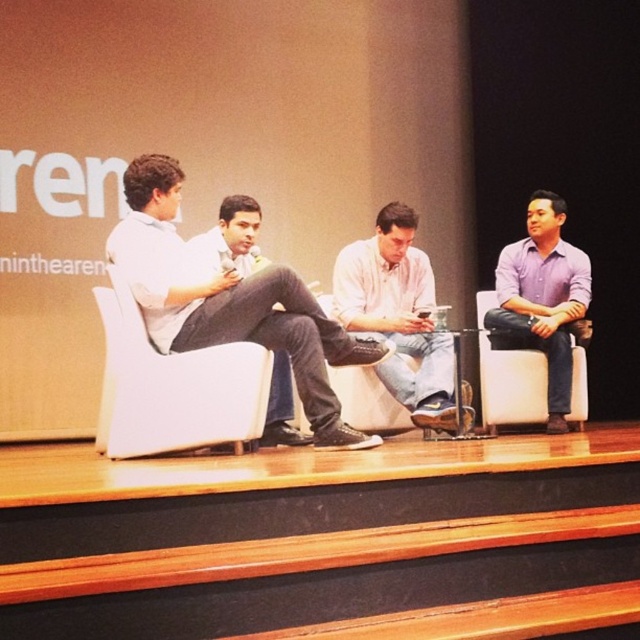
Question: Which of the following is the farthest from the observer?

Choices:
 (A) (352, 284)
 (B) (225, 372)
 (C) (230, 310)
 (D) (208, 234)

Answer: (A)

Question: Which of the following is the closest to the observer?

Choices:
 (A) white fabric armchair at center
 (B) dark gray jeans at center

Answer: (A)

Question: Which of the following is the farthest from the observer?

Choices:
 (A) (364, 280)
 (B) (125, 412)
 (C) (180, 284)

Answer: (A)

Question: Does white cotton shirt at center appear on the right side of dark gray jeans at center?

Choices:
 (A) no
 (B) yes

Answer: (B)

Question: Does white matte shirt at center come behind white cotton shirt at center?

Choices:
 (A) no
 (B) yes

Answer: (A)

Question: Does white matte shirt at center come in front of purple matte shirt at right?

Choices:
 (A) yes
 (B) no

Answer: (A)